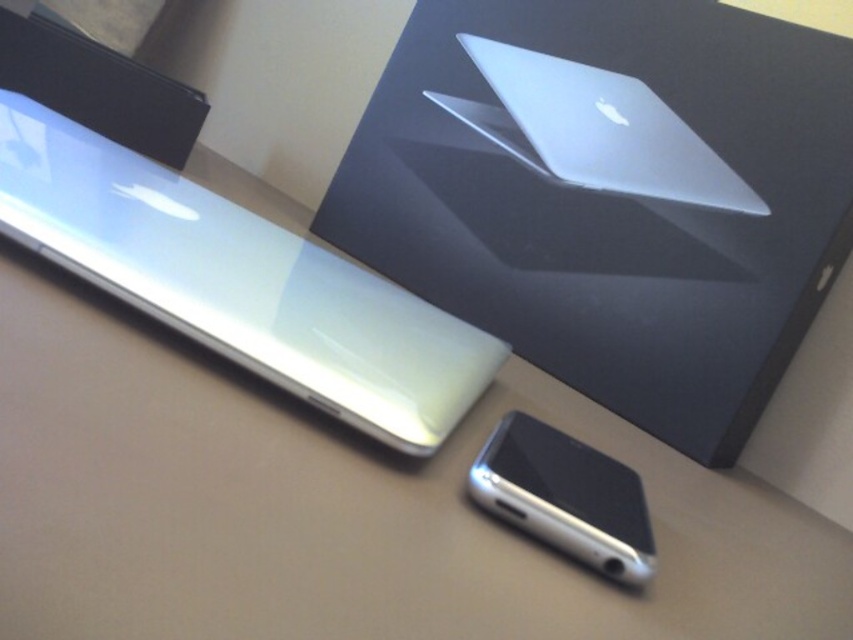
Question: Among these points, which one is farthest from the camera?

Choices:
 (A) (587, 515)
 (B) (408, 196)
 (C) (286, 269)
 (D) (621, 92)

Answer: (B)

Question: Does silver metallic laptop at upper right appear over silver metallic smartphone at lower center?

Choices:
 (A) no
 (B) yes

Answer: (B)

Question: Which of the following is the closest to the observer?

Choices:
 (A) (134, 280)
 (B) (689, 204)

Answer: (A)

Question: Can you confirm if sleek silver laptop at upper center is positioned to the right of silver metallic smartphone at lower center?

Choices:
 (A) yes
 (B) no

Answer: (A)

Question: Which point is closer to the camera taking this photo?

Choices:
 (A) (161, 252)
 (B) (524, 52)

Answer: (A)

Question: Can you confirm if sleek silver laptop at upper center is positioned above glossy white tablet at upper left?

Choices:
 (A) yes
 (B) no

Answer: (A)